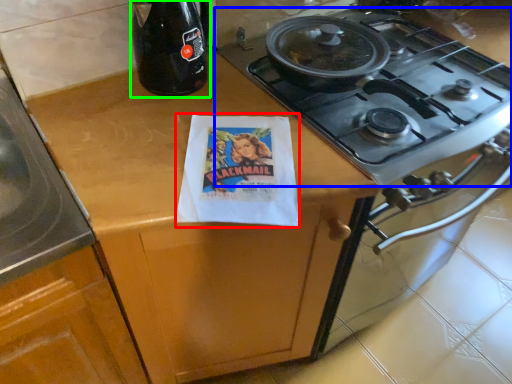
Question: Which object is positioned farthest from flyer (highlighted by a red box)? Select from gas stove (highlighted by a blue box) and bottle (highlighted by a green box).

Choices:
 (A) gas stove
 (B) bottle

Answer: (A)